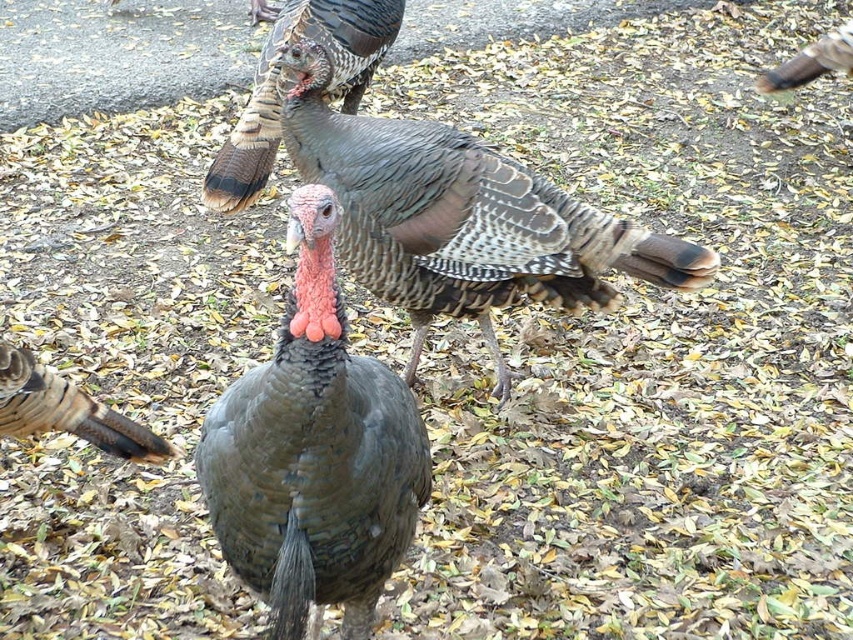
Question: Which object appears farthest from the camera in this image?

Choices:
 (A) speckled feathered turkey at center
 (B) brown feathered turkey at upper right
 (C) speckled feathered turkey at upper center
 (D) gray matte turkey at center

Answer: (B)

Question: Considering the relative positions of speckled feathered turkey at upper center and speckled feathered turkey at lower left in the image provided, where is speckled feathered turkey at upper center located with respect to speckled feathered turkey at lower left?

Choices:
 (A) left
 (B) right

Answer: (B)

Question: Is speckled feathered turkey at center closer to camera compared to speckled feathered turkey at upper center?

Choices:
 (A) yes
 (B) no

Answer: (A)

Question: From the image, what is the correct spatial relationship of speckled feathered turkey at upper center in relation to brown feathered turkey at upper right?

Choices:
 (A) above
 (B) below

Answer: (B)

Question: Which point is farther to the camera?

Choices:
 (A) brown feathered turkey at upper right
 (B) speckled feathered turkey at upper center
 (C) speckled feathered turkey at center
 (D) gray matte turkey at center

Answer: (A)

Question: Which object appears farthest from the camera in this image?

Choices:
 (A) speckled feathered turkey at upper center
 (B) speckled feathered turkey at center
 (C) brown feathered turkey at upper right
 (D) gray matte turkey at center

Answer: (C)